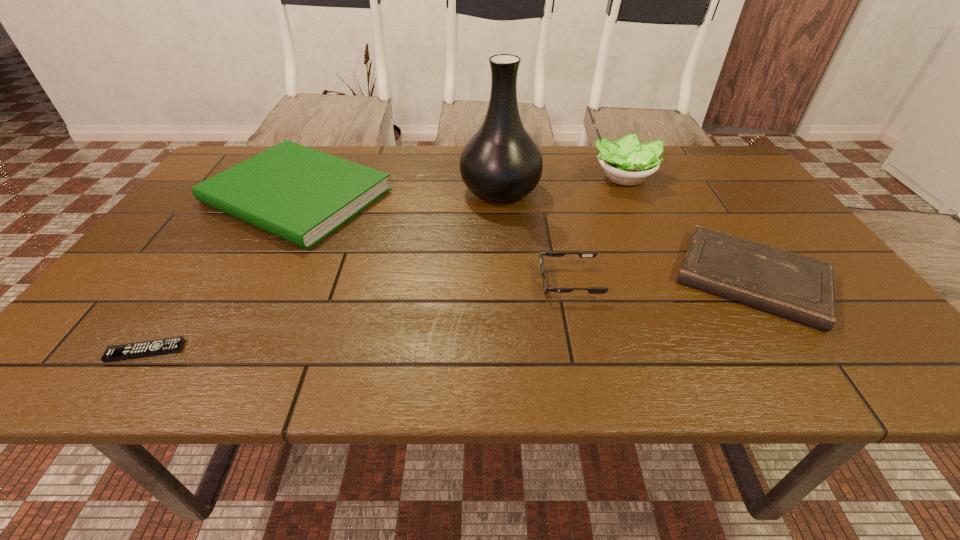
Image resolution: width=960 pixels, height=540 pixels. Identify the location of vase. (501, 162).

At what (x,y) coordinates should I click in order to perform the action: click on lettuce. Please return your answer as a coordinate pair (x, y). This screenshot has width=960, height=540. Looking at the image, I should click on (627, 162).

Locate an element on the screen. This screenshot has height=540, width=960. the fourth shortest object is located at coordinates (299, 194).

The image size is (960, 540). Find the location of `the left paperback book`. the left paperback book is located at coordinates (299, 194).

Where is `the third shortest object`? The height and width of the screenshot is (540, 960). the third shortest object is located at coordinates (591, 290).

This screenshot has width=960, height=540. What are the coordinates of `the right paperback book` in the screenshot? It's located at (801, 288).

Find the location of a particular element. Image resolution: width=960 pixels, height=540 pixels. the fifth tallest object is located at coordinates (801, 288).

Locate an element on the screen. This screenshot has height=540, width=960. the nearest object is located at coordinates (165, 346).

Where is `the shortest object`? the shortest object is located at coordinates (165, 346).

The width and height of the screenshot is (960, 540). Find the location of `vacant space located on the left of the vase`. vacant space located on the left of the vase is located at coordinates (345, 190).